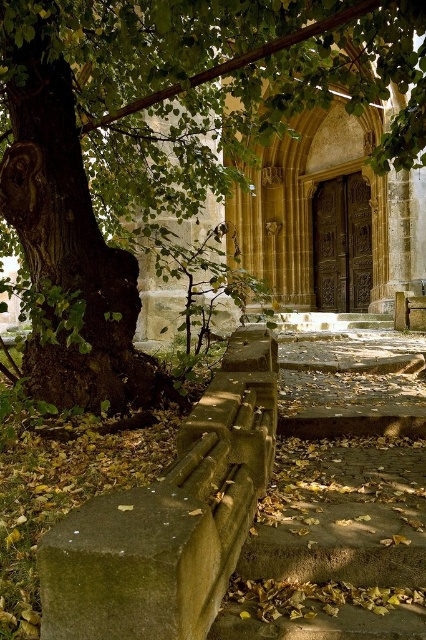
Does green leafy tree at upper left lie in front of concrete stairs at center?

No, green leafy tree at upper left is further to the viewer.

Does green leafy tree at upper left appear over concrete stairs at center?

Yes.

Is point (46, 369) closer to camera compared to point (305, 403)?

That is True.

The height and width of the screenshot is (640, 426). What are the coordinates of `green leafy tree at upper left` in the screenshot? It's located at (161, 144).